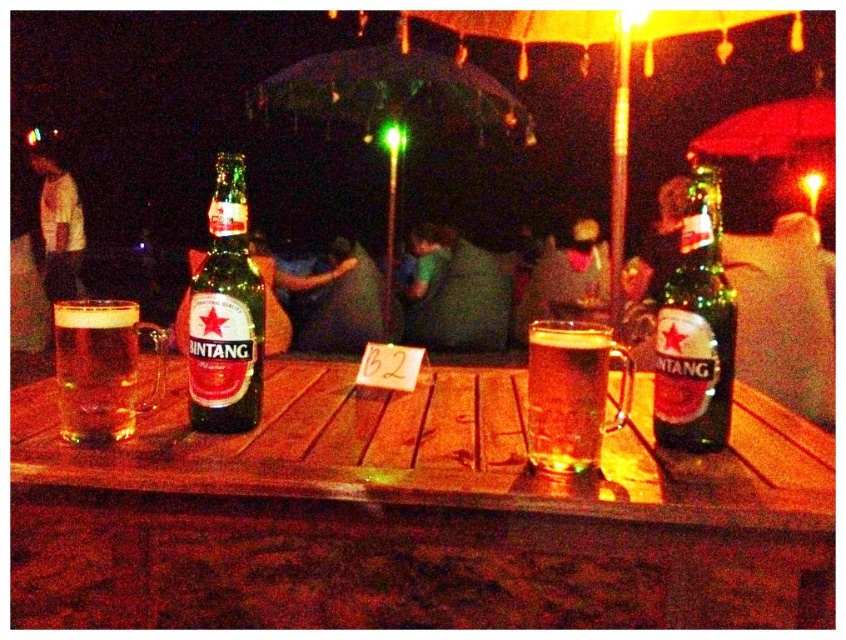
Question: Which object appears closest to the camera in this image?

Choices:
 (A) wooden table at center
 (B) green glass bottle at right
 (C) translucent glass mug at center

Answer: (A)

Question: Is orange fabric umbrella at upper center wider than smooth fabric shirt at center?

Choices:
 (A) no
 (B) yes

Answer: (B)

Question: Among these points, which one is nearest to the camera?

Choices:
 (A) (389, 202)
 (B) (573, 456)

Answer: (B)

Question: Can you confirm if translucent glass mug at center is thinner than white cotton shirt at upper left?

Choices:
 (A) yes
 (B) no

Answer: (A)

Question: In this image, where is green glass bottle at center located relative to translucent glass mug at left?

Choices:
 (A) left
 (B) right

Answer: (B)

Question: Among these points, which one is nearest to the camera?

Choices:
 (A) (528, 304)
 (B) (551, 438)

Answer: (B)